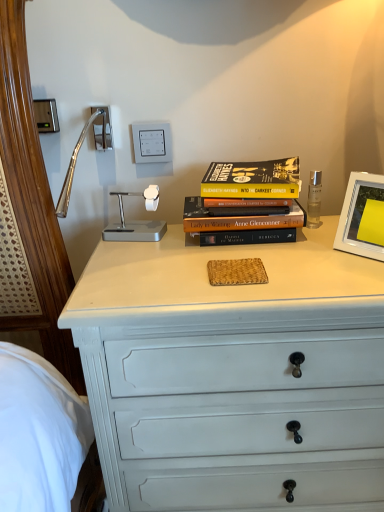
Question: Is white plastic picture frame at upper right to the left of satin nickel outlet at upper left, the second electric outlet viewed from the right, from the viewer's perspective?

Choices:
 (A) no
 (B) yes

Answer: (A)

Question: Could you tell me if white plastic picture frame at upper right is facing satin nickel outlet at upper left, positioned as the 1th electric outlet in left-to-right order?

Choices:
 (A) yes
 (B) no

Answer: (B)

Question: Is white plastic picture frame at upper right at the right side of satin nickel outlet at upper left, positioned as the 1th electric outlet in left-to-right order?

Choices:
 (A) yes
 (B) no

Answer: (A)

Question: From the image's perspective, is white plastic picture frame at upper right on top of satin nickel outlet at upper left, positioned as the 1th electric outlet in left-to-right order?

Choices:
 (A) no
 (B) yes

Answer: (A)

Question: Can you confirm if white plastic picture frame at upper right is taller than satin nickel outlet at upper left, the second electric outlet viewed from the right?

Choices:
 (A) no
 (B) yes

Answer: (B)

Question: From a real-world perspective, is hardcover book at center physically located above or below white plastic picture frame at upper right?

Choices:
 (A) below
 (B) above

Answer: (B)

Question: In terms of height, does hardcover book at center look taller or shorter compared to white plastic picture frame at upper right?

Choices:
 (A) short
 (B) tall

Answer: (B)

Question: Considering their positions, is hardcover book at center located in front of or behind white plastic picture frame at upper right?

Choices:
 (A) front
 (B) behind

Answer: (B)

Question: Considering the positions of hardcover book at center and white plastic picture frame at upper right in the image, is hardcover book at center bigger or smaller than white plastic picture frame at upper right?

Choices:
 (A) small
 (B) big

Answer: (B)

Question: In terms of height, does white plastic picture frame at upper right look taller or shorter compared to white plastic switch at upper center, which is the second electric outlet in left-to-right order?

Choices:
 (A) short
 (B) tall

Answer: (B)

Question: Visually, is white plastic picture frame at upper right positioned to the left or to the right of white plastic switch at upper center, which is the second electric outlet in left-to-right order?

Choices:
 (A) left
 (B) right

Answer: (B)

Question: From a real-world perspective, is white plastic picture frame at upper right above or below white plastic switch at upper center, which appears as the first electric outlet when viewed from the right?

Choices:
 (A) above
 (B) below

Answer: (B)

Question: Is point (352, 193) closer or farther from the camera than point (167, 135)?

Choices:
 (A) farther
 (B) closer

Answer: (B)

Question: Is white plastic switch at upper center, which appears as the first electric outlet when viewed from the right, bigger or smaller than white plastic picture frame at upper right?

Choices:
 (A) small
 (B) big

Answer: (A)

Question: Is white plastic switch at upper center, which is the second electric outlet in left-to-right order, to the left or to the right of white plastic picture frame at upper right in the image?

Choices:
 (A) left
 (B) right

Answer: (A)